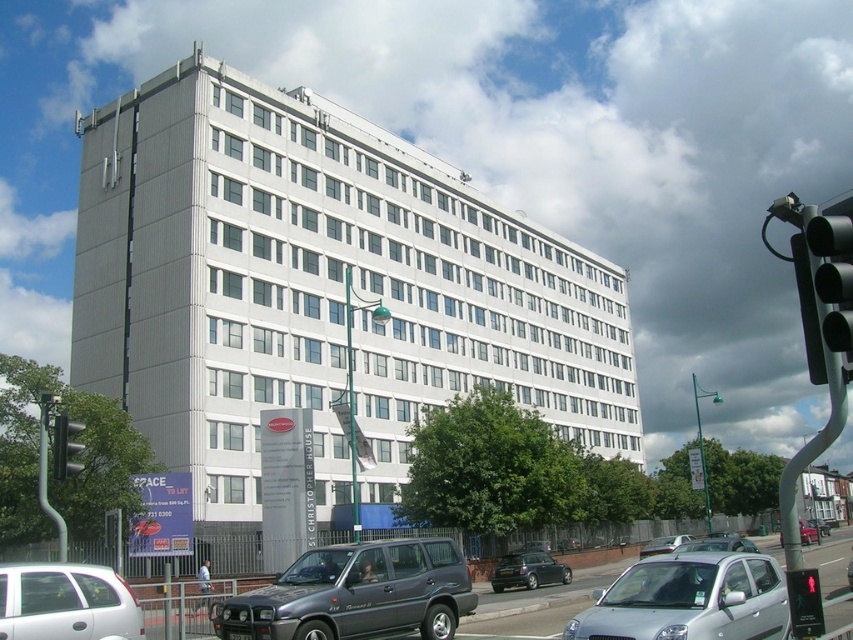
You are a pedestrian standing at the crosswalk and see both the black plastic traffic light at right and the green glass traffic light at left. Which traffic light is located to the east side of the other?

The black plastic traffic light at right is positioned on the right side of green glass traffic light at left, so it is located to the east side if the pedestrian is facing north.

You are a delivery person trying to park your 1.8 meters tall delivery box in the space between the metallic gray suv at center and the metallic gray car at lower center. Can the delivery box fit vertically between them?

The metallic gray suv at center is taller than the metallic gray car at lower center. Since the delivery box is 1.8 meters tall, it can fit vertically between them as long as the space between the two vehicles is at least 1.8 meters in height.

You are a delivery driver in a van that is 3 meters long. You need to park your van between the metallic gray suv at center and the silver metallic hatchback at lower center. Is there enough space between them to park your van?

The distance between the metallic gray suv at center and the silver metallic hatchback at lower center is 6.93 meters. Since your van is 3 meters long, there is sufficient space to park between them.